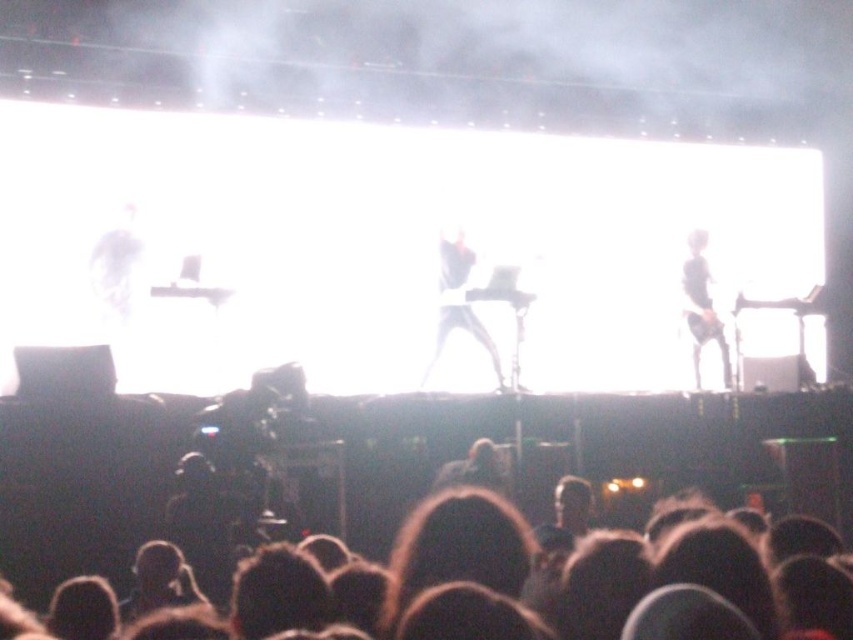
Question: Observing the image, what is the correct spatial positioning of black matte guitar at center in reference to black matte guitar at right?

Choices:
 (A) below
 (B) above

Answer: (A)

Question: Among these objects, which one is nearest to the camera?

Choices:
 (A) black matte guitar at center
 (B) black matte guitar at right

Answer: (A)

Question: Is black matte guitar at center bigger than black matte guitar at right?

Choices:
 (A) no
 (B) yes

Answer: (B)

Question: Among these points, which one is nearest to the camera?

Choices:
 (A) (437, 280)
 (B) (708, 316)

Answer: (A)

Question: Which point is closer to the camera?

Choices:
 (A) (x=706, y=307)
 (B) (x=439, y=348)

Answer: (B)

Question: Does black matte guitar at center appear on the left side of black matte guitar at right?

Choices:
 (A) yes
 (B) no

Answer: (A)